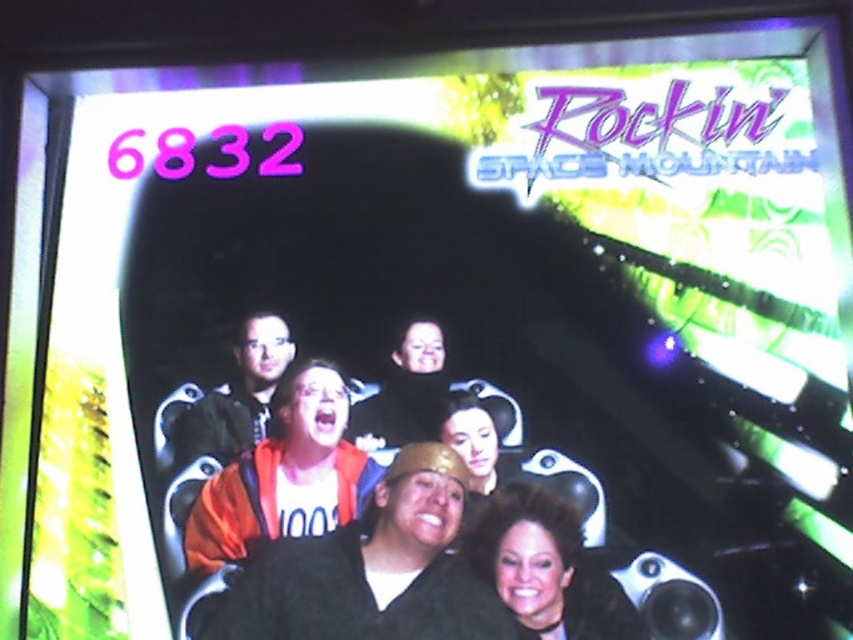
You are designing a new ride seat that needs to accommodate both the black matte jacket at center and the shiny black hair at center. Based on the scene, which object requires more horizontal space in the seat design?

The black matte jacket at center requires more horizontal space in the seat design because its width is larger than the shiny black hair at center.

You are a photographer trying to capture a clear photo of the two people at the center of the ride. The black matte jacket at center and the shiny black hair at center are both in your viewfinder. Since you want to focus on the larger object, which one should you adjust your camera to focus on?

The black matte jacket at center is larger in size than the shiny black hair at center, so you should focus on the black matte jacket at center.

You are a photographer taking a picture of the black matte jacket at center and the shiny black hair at center in the scene. To ensure both are in frame, should you pan your camera to the left or right?

The black matte jacket at center is to the left of the shiny black hair at center, so you should pan your camera to the right to include both in the frame.